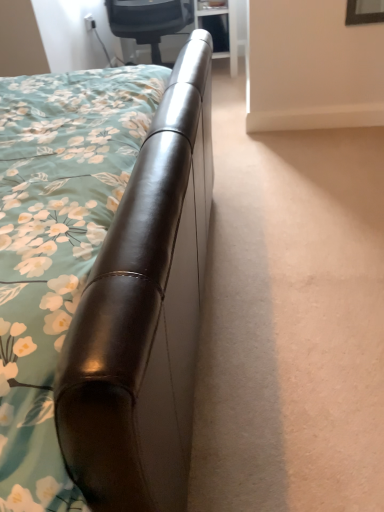
The height and width of the screenshot is (512, 384). I want to click on matte black chair at upper center, so click(x=149, y=21).

What do you see at coordinates (149, 21) in the screenshot? I see `matte black chair at upper center` at bounding box center [149, 21].

Measure the distance between matte black chair at upper center and camera.

8.35 feet.

Locate an element on the screen. This screenshot has height=512, width=384. brown leather bed at upper left is located at coordinates (143, 313).

Describe the element at coordinates (143, 313) in the screenshot. This screenshot has height=512, width=384. I see `brown leather bed at upper left` at that location.

Image resolution: width=384 pixels, height=512 pixels. In order to click on matte black chair at upper center in this screenshot , I will do `click(149, 21)`.

Between matte black chair at upper center and brown leather bed at upper left, which one appears on the right side from the viewer's perspective?

matte black chair at upper center.

Which object is closer to the camera taking this photo, matte black chair at upper center or brown leather bed at upper left?

brown leather bed at upper left.

Is point (127, 10) positioned in front of point (83, 479)?

No, (127, 10) is further to viewer.

From the image's perspective, relative to brown leather bed at upper left, is matte black chair at upper center above or below?

matte black chair at upper center is above brown leather bed at upper left.

From a real-world perspective, is matte black chair at upper center over brown leather bed at upper left?

Actually, matte black chair at upper center is physically below brown leather bed at upper left in the real world.

Is matte black chair at upper center thinner than brown leather bed at upper left?

Yes.

Is matte black chair at upper center taller or shorter than brown leather bed at upper left?

In the image, matte black chair at upper center appears to be shorter than brown leather bed at upper left.

Considering the sizes of objects matte black chair at upper center and brown leather bed at upper left in the image provided, who is bigger, matte black chair at upper center or brown leather bed at upper left?

brown leather bed at upper left is bigger.

Based on the photo, choose the correct answer: Is matte black chair at upper center inside brown leather bed at upper left or outside it?

matte black chair at upper center lies outside brown leather bed at upper left.

Is matte black chair at upper center touching brown leather bed at upper left?

No, matte black chair at upper center is not touching brown leather bed at upper left.

Is brown leather bed at upper left at the back of matte black chair at upper center?

That's right, matte black chair at upper center is facing away from brown leather bed at upper left.

How different are the orientations of matte black chair at upper center and brown leather bed at upper left in degrees?

The angular difference between matte black chair at upper center and brown leather bed at upper left is 89.5 degrees.

Measure the distance from matte black chair at upper center to brown leather bed at upper left.

The distance of matte black chair at upper center from brown leather bed at upper left is 6.54 feet.

Locate an element on the screen. chair behind the brown leather bed at upper left is located at coordinates (149, 21).

Which is more to the right, brown leather bed at upper left or matte black chair at upper center?

From the viewer's perspective, matte black chair at upper center appears more on the right side.

From the picture: Is the position of brown leather bed at upper left more distant than that of matte black chair at upper center?

No, it is in front of matte black chair at upper center.

Is point (90, 412) farther from camera compared to point (133, 1)?

No, (90, 412) is closer to viewer.

From the image's perspective, would you say brown leather bed at upper left is positioned over matte black chair at upper center?

No, from the image's perspective, brown leather bed at upper left is not over matte black chair at upper center.

From a real-world perspective, is brown leather bed at upper left on matte black chair at upper center?

Yes, from a real-world perspective, brown leather bed at upper left is over matte black chair at upper center

Considering the relative sizes of brown leather bed at upper left and matte black chair at upper center in the image provided, is brown leather bed at upper left wider than matte black chair at upper center?

Correct, the width of brown leather bed at upper left exceeds that of matte black chair at upper center.

Can you confirm if brown leather bed at upper left is shorter than matte black chair at upper center?

No.

Between brown leather bed at upper left and matte black chair at upper center, which one has larger size?

brown leather bed at upper left.

Is matte black chair at upper center inside brown leather bed at upper left?

No, matte black chair at upper center is not inside brown leather bed at upper left.

Are brown leather bed at upper left and matte black chair at upper center located far from each other?

Yes.

Is brown leather bed at upper left oriented away from matte black chair at upper center?

No.

Can you tell me how much brown leather bed at upper left and matte black chair at upper center differ in facing direction?

The angle between the facing direction of brown leather bed at upper left and the facing direction of matte black chair at upper center is 89.5 degrees.

Locate an element on the screen. The width and height of the screenshot is (384, 512). bed above the matte black chair at upper center (from a real-world perspective) is located at coordinates (143, 313).

This screenshot has width=384, height=512. In order to click on bed located above the matte black chair at upper center (from a real-world perspective) in this screenshot , I will do `click(143, 313)`.

Find the location of a particular element. The image size is (384, 512). chair above the brown leather bed at upper left (from the image's perspective) is located at coordinates (149, 21).